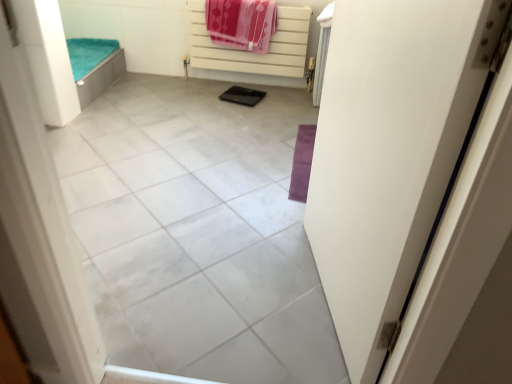
Question: Is gray tile at center to the right of white matte radiator at upper center from the viewer's perspective?

Choices:
 (A) yes
 (B) no

Answer: (B)

Question: Is gray tile at center facing towards white matte radiator at upper center?

Choices:
 (A) no
 (B) yes

Answer: (A)

Question: Is gray tile at center not near white matte radiator at upper center?

Choices:
 (A) yes
 (B) no

Answer: (A)

Question: Is gray tile at center next to white matte radiator at upper center?

Choices:
 (A) yes
 (B) no

Answer: (B)

Question: Considering the relative sizes of gray tile at center and white matte radiator at upper center in the image provided, is gray tile at center shorter than white matte radiator at upper center?

Choices:
 (A) yes
 (B) no

Answer: (A)

Question: From a real-world perspective, is polka dot fabric beach towel at upper center physically located above or below gray tile at center?

Choices:
 (A) above
 (B) below

Answer: (A)

Question: Is point (247, 23) positioned closer to the camera than point (176, 200)?

Choices:
 (A) closer
 (B) farther

Answer: (B)

Question: From the image's perspective, is polka dot fabric beach towel at upper center above or below gray tile at center?

Choices:
 (A) below
 (B) above

Answer: (B)

Question: Is polka dot fabric beach towel at upper center inside or outside of gray tile at center?

Choices:
 (A) inside
 (B) outside

Answer: (B)

Question: From the image's perspective, is gray tile at center positioned above or below polka dot fabric beach towel at upper center?

Choices:
 (A) above
 (B) below

Answer: (B)

Question: From a real-world perspective, is gray tile at center positioned above or below polka dot fabric beach towel at upper center?

Choices:
 (A) above
 (B) below

Answer: (B)

Question: Is point (245, 284) positioned closer to the camera than point (266, 49)?

Choices:
 (A) farther
 (B) closer

Answer: (B)

Question: Is gray tile at center bigger or smaller than polka dot fabric beach towel at upper center?

Choices:
 (A) big
 (B) small

Answer: (A)

Question: Is white matte radiator at upper center in front of or behind gray tile at center in the image?

Choices:
 (A) front
 (B) behind

Answer: (B)

Question: From the image's perspective, is white matte radiator at upper center above or below gray tile at center?

Choices:
 (A) below
 (B) above

Answer: (B)